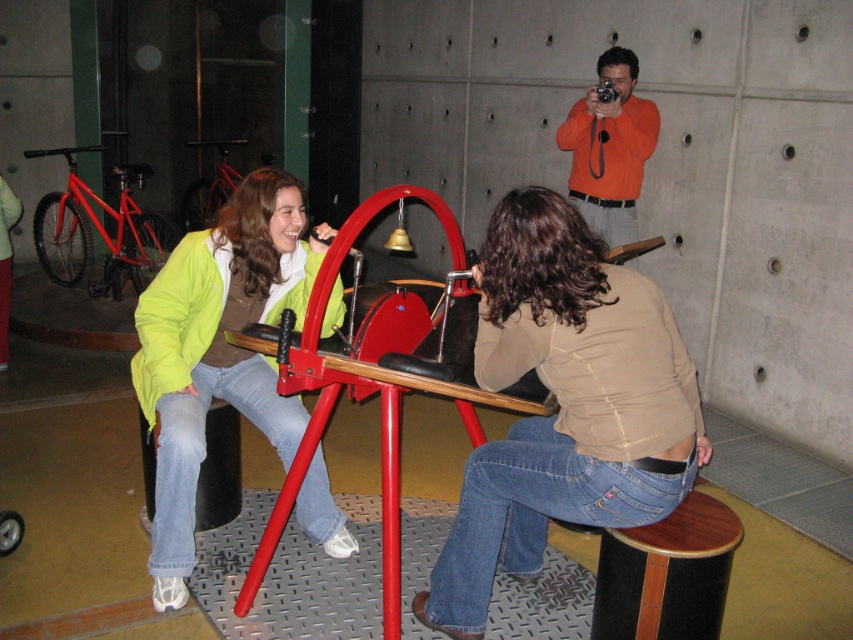
Does matte brown shirt at center have a smaller size compared to orange cotton shirt at upper center?

No.

Who is lower down, matte brown shirt at center or orange cotton shirt at upper center?

matte brown shirt at center is lower down.

Between point (660, 497) and point (625, 172), which one is positioned behind?

The point (625, 172) is more distant.

Locate an element on the screen. matte brown shirt at center is located at coordinates (563, 404).

Which is above, matte brown shirt at center or matte green jacket at center?

matte green jacket at center is above.

Who is more forward, (505, 513) or (306, 269)?

Point (505, 513) is more forward.

The width and height of the screenshot is (853, 640). I want to click on matte brown shirt at center, so click(563, 404).

Which is above, matte green jacket at center or orange cotton shirt at upper center?

orange cotton shirt at upper center

Is matte green jacket at center to the left of orange cotton shirt at upper center from the viewer's perspective?

Correct, you'll find matte green jacket at center to the left of orange cotton shirt at upper center.

Locate an element on the screen. Image resolution: width=853 pixels, height=640 pixels. matte green jacket at center is located at coordinates (218, 349).